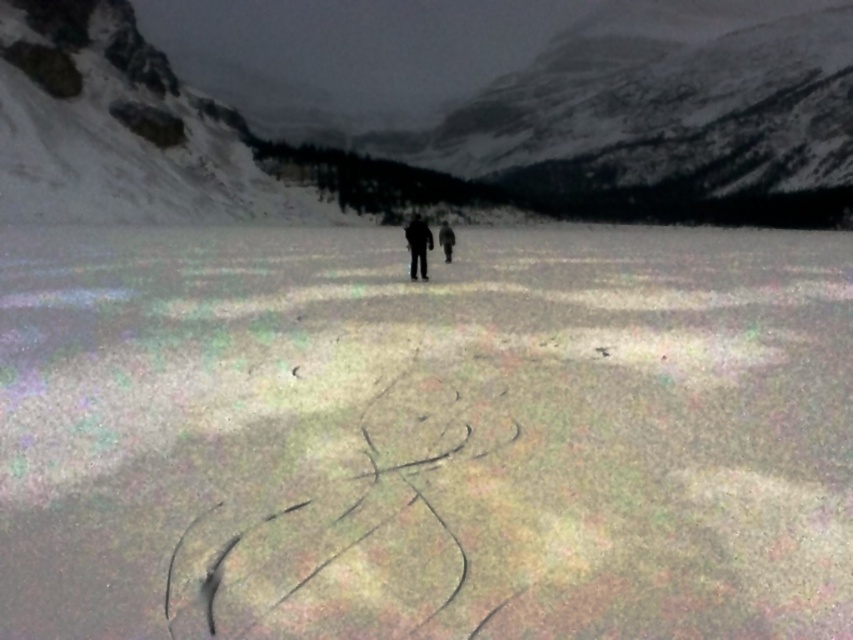
Between point (277, 321) and point (416, 250), which one is positioned in front?

Point (277, 321)

Does white textured snow at center have a lesser width compared to dark fabric figure at center?

Incorrect, white textured snow at center's width is not less than dark fabric figure at center's.

I want to click on white textured snow at center, so click(425, 433).

Does snowy granite mountain at upper center appear on the left side of dark fabric figure at center?

In fact, snowy granite mountain at upper center is to the right of dark fabric figure at center.

Describe the element at coordinates (439, 106) in the screenshot. I see `snowy granite mountain at upper center` at that location.

Image resolution: width=853 pixels, height=640 pixels. What do you see at coordinates (439, 106) in the screenshot? I see `snowy granite mountain at upper center` at bounding box center [439, 106].

Identify the location of snowy granite mountain at upper center. The image size is (853, 640). (439, 106).

Which is more to the left, white textured snow at center or black matte jacket at center?

white textured snow at center is more to the left.

Between white textured snow at center and black matte jacket at center, which one has more height?

black matte jacket at center

Identify the location of white textured snow at center. (425, 433).